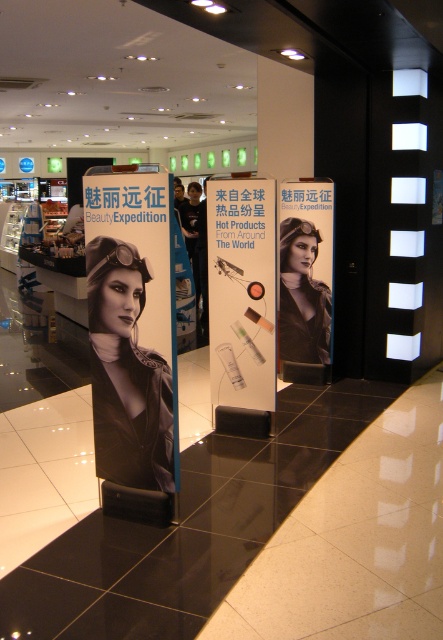
Question: Which object is positioned closest to the white paper at center?

Choices:
 (A) black glossy poster at center
 (B) matte black helmet at center

Answer: (A)

Question: Can you confirm if black glossy poster at center is bigger than white paper at center?

Choices:
 (A) no
 (B) yes

Answer: (A)

Question: Estimate the real-world distances between objects in this image. Which object is farther from the matte black helmet at center?

Choices:
 (A) black glossy poster at center
 (B) white paper at center

Answer: (A)

Question: Among these objects, which one is farthest from the camera?

Choices:
 (A) matte black helmet at center
 (B) white paper at center

Answer: (A)

Question: Is white paper at center above matte black helmet at center?

Choices:
 (A) yes
 (B) no

Answer: (B)

Question: Is black glossy poster at center bigger than matte black helmet at center?

Choices:
 (A) no
 (B) yes

Answer: (A)